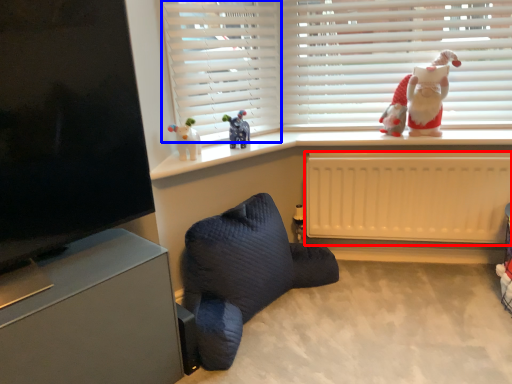
Question: Which object is closer to the camera taking this photo, radiator (highlighted by a red box) or curtain (highlighted by a blue box)?

Choices:
 (A) radiator
 (B) curtain

Answer: (B)